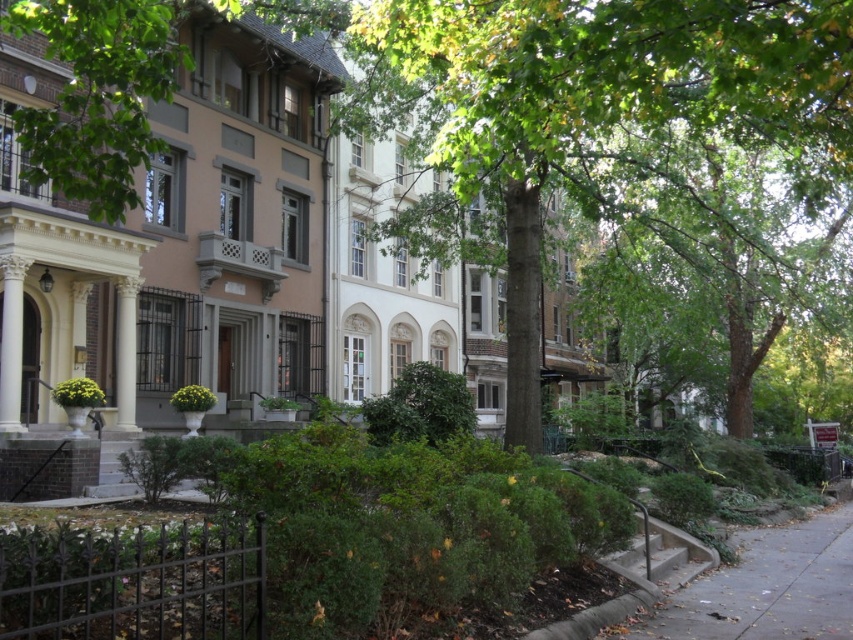
Consider the image. You are a delivery person approaching the gray concrete sidewalk at lower right and need to avoid the green leafy tree at center. Which direction should you turn to reach the sidewalk safely?

The green leafy tree at center is to the left of gray concrete sidewalk at lower right. To avoid the tree and reach the sidewalk safely, turn to the right.

You are a gardener planning to plant a new tree in the residential area. The tree you want to plant requires a space wider than the gray concrete sidewalk at lower right. Based on the image, is the green leafy tree at center suitable for your needs?

The green leafy tree at center has a width larger than the gray concrete sidewalk at lower right, so it is suitable for planting since it meets the required space width.